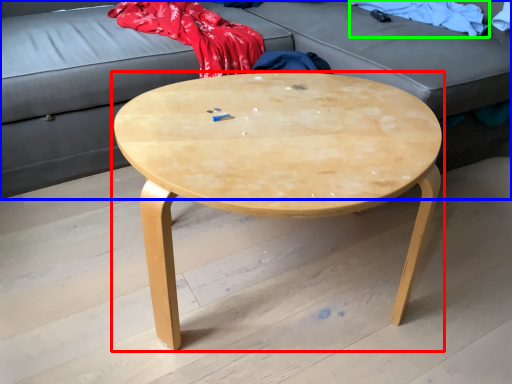
Question: Which object is the farthest from coffee table (highlighted by a red box)? Choose among these: studio couch (highlighted by a blue box) or clothing (highlighted by a green box).

Choices:
 (A) studio couch
 (B) clothing

Answer: (B)